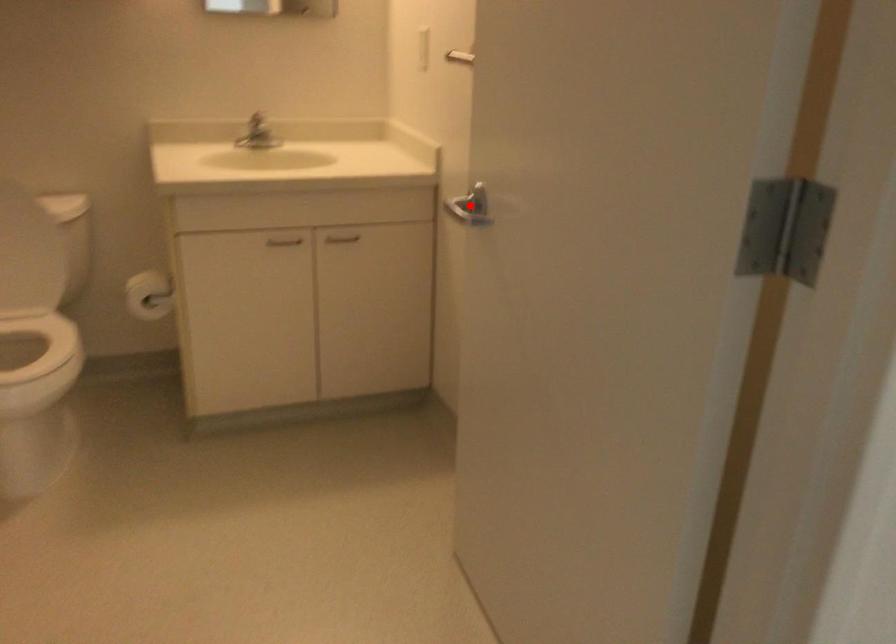
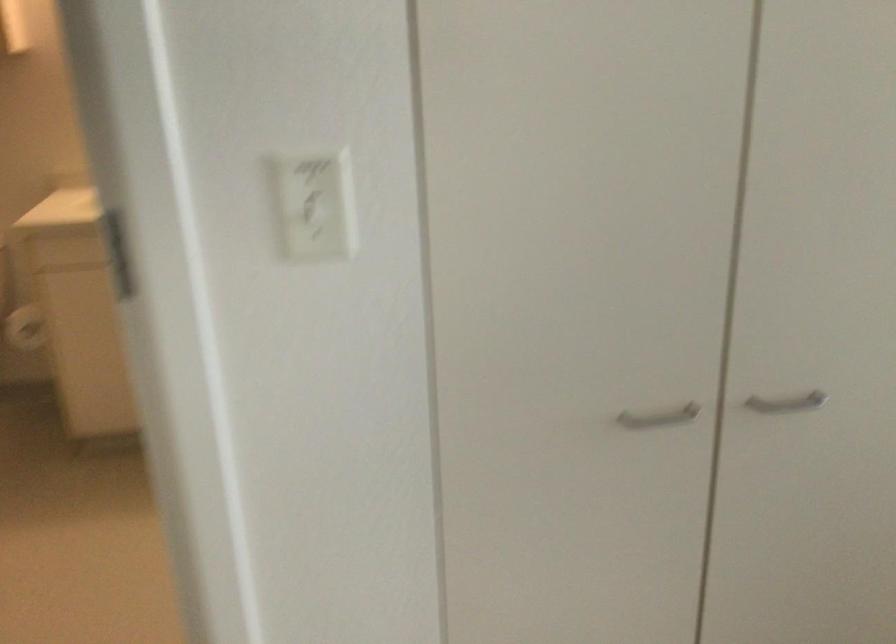
Question: I am providing you with two images of the same scene from different viewpoints. A red point is marked on the first image. Is the red point's position out of view in image 2?

Choices:
 (A) Yes
 (B) No

Answer: (A)